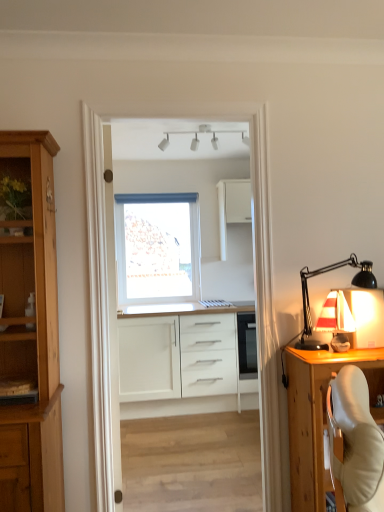
Find the location of a particular element. blank space above white glossy cabinet at center (from a real-world perspective) is located at coordinates (179, 94).